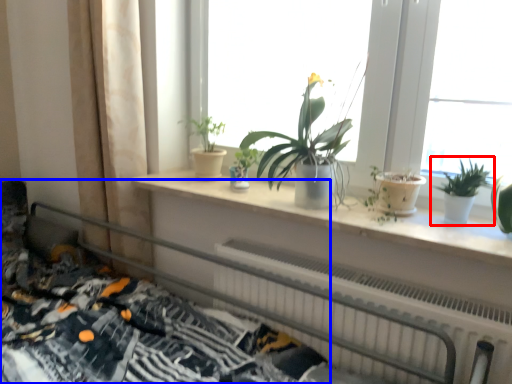
Question: Which of the following is the closest to the observer, houseplant (highlighted by a red box) or bed (highlighted by a blue box)?

Choices:
 (A) houseplant
 (B) bed

Answer: (B)